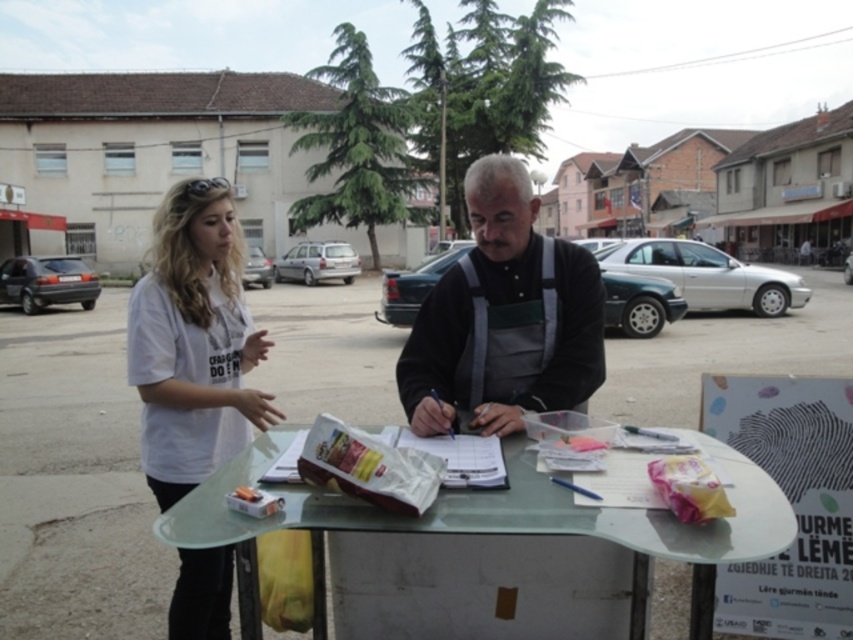
Does point (515, 253) come farther from viewer compared to point (148, 419)?

No, it is not.

Is point (587, 360) more distant than point (194, 432)?

No.

In order to click on dark gray fabric vest at center in this screenshot , I will do `click(503, 317)`.

Does clear glass table at center have a larger size compared to white cotton shirt at left?

Indeed, clear glass table at center has a larger size compared to white cotton shirt at left.

In order to click on clear glass table at center in this screenshot , I will do `click(492, 525)`.

Can you confirm if white t-shirt at left is positioned to the right of dark gray fabric vest at center?

Yes, white t-shirt at left is to the right of dark gray fabric vest at center.

Is white t-shirt at left bigger than dark gray fabric vest at center?

No, white t-shirt at left is not bigger than dark gray fabric vest at center.

Between point (479, 179) and point (403, 346), which one is positioned behind?

Point (403, 346)

Locate an element on the screen. This screenshot has height=640, width=853. white t-shirt at left is located at coordinates (503, 317).